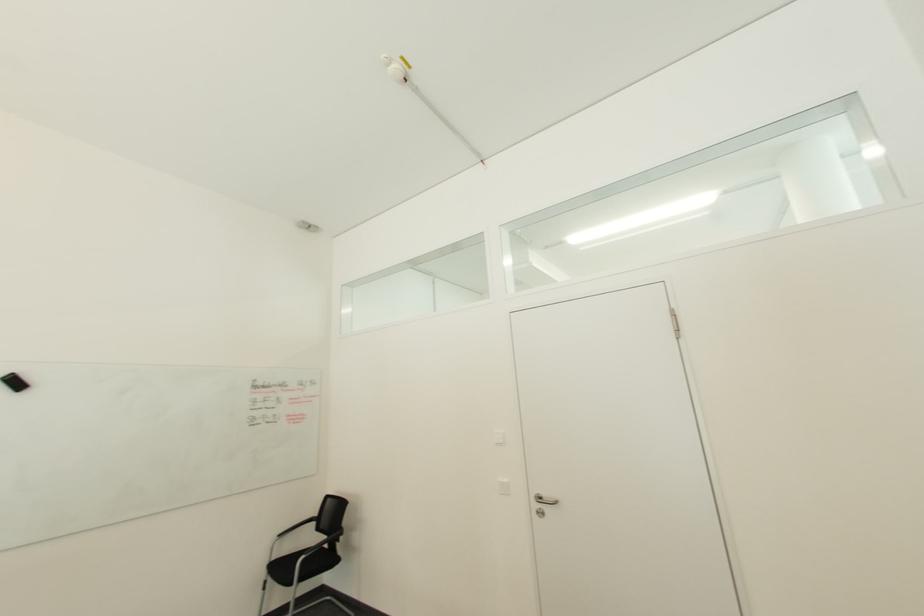
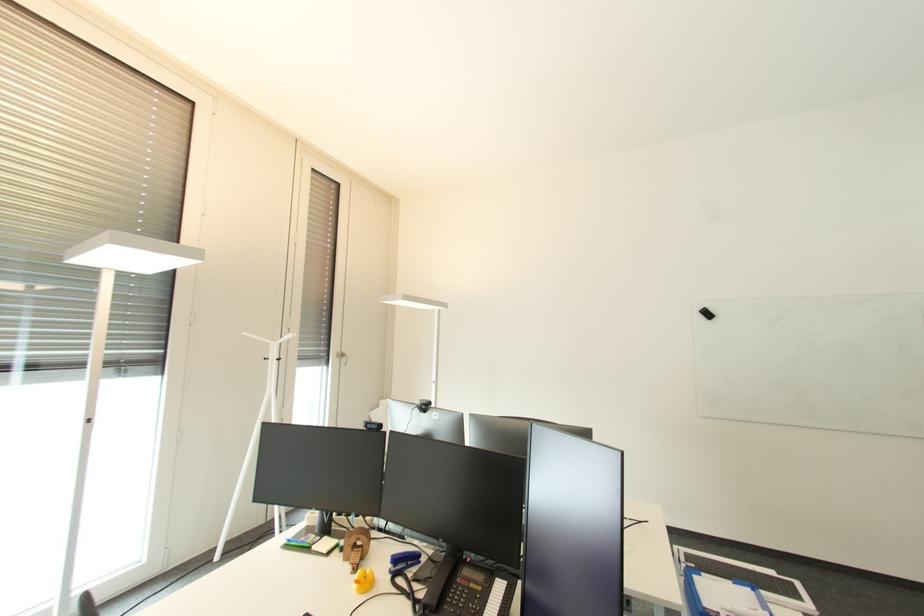
Question: How did the camera likely rotate?

Choices:
 (A) Left
 (B) Right
 (C) Up
 (D) Down

Answer: (A)